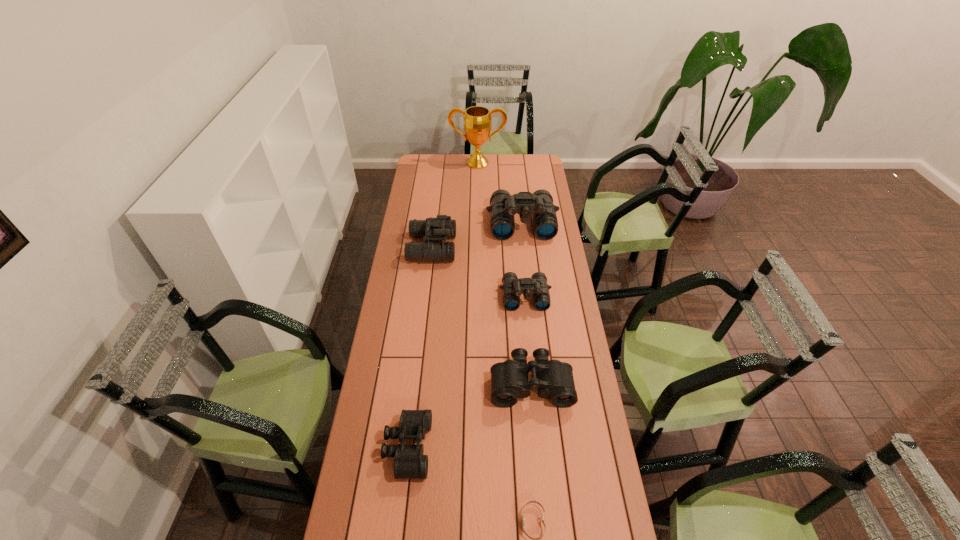
In the image, there is a desktop. Where is `free space at the left edge`? free space at the left edge is located at coordinates (397, 249).

Locate an element on the screen. blank space at the right edge of the desktop is located at coordinates (577, 355).

Locate an element on the screen. empty location between the second smallest blue binoculars and the tallest binoculars is located at coordinates (477, 235).

The width and height of the screenshot is (960, 540). I want to click on free space between the smallest blue binoculars and the shortest binoculars, so click(x=467, y=372).

Where is `free space between the right black binoculars and the farthest object`? free space between the right black binoculars and the farthest object is located at coordinates (504, 273).

Locate an element on the screen. The image size is (960, 540). free space between the second nearest object and the gold award is located at coordinates (443, 306).

Locate an element on the screen. This screenshot has width=960, height=540. vacant region between the nearer black binoculars and the farthest object is located at coordinates (443, 306).

Image resolution: width=960 pixels, height=540 pixels. Identify the location of free area in between the biggest blue binoculars and the nearer black binoculars. (465, 335).

At what (x,y) coordinates should I click in order to perform the action: click on the third closest object to the tallest object. Please return your answer as a coordinate pair (x, y). This screenshot has height=540, width=960. Looking at the image, I should click on (512, 288).

Identify the location of the fourth closest object to the third farthest binoculars. (410, 463).